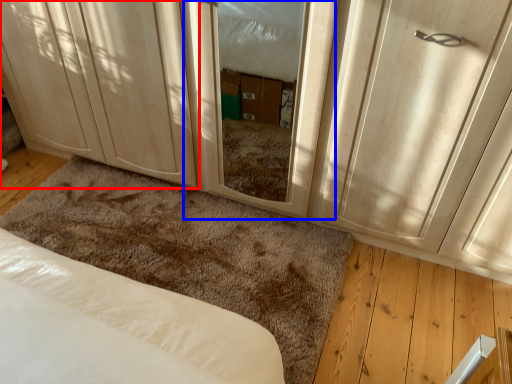
Question: Which object is further to the camera taking this photo, cabinetry (highlighted by a red box) or screen door (highlighted by a blue box)?

Choices:
 (A) cabinetry
 (B) screen door

Answer: (A)